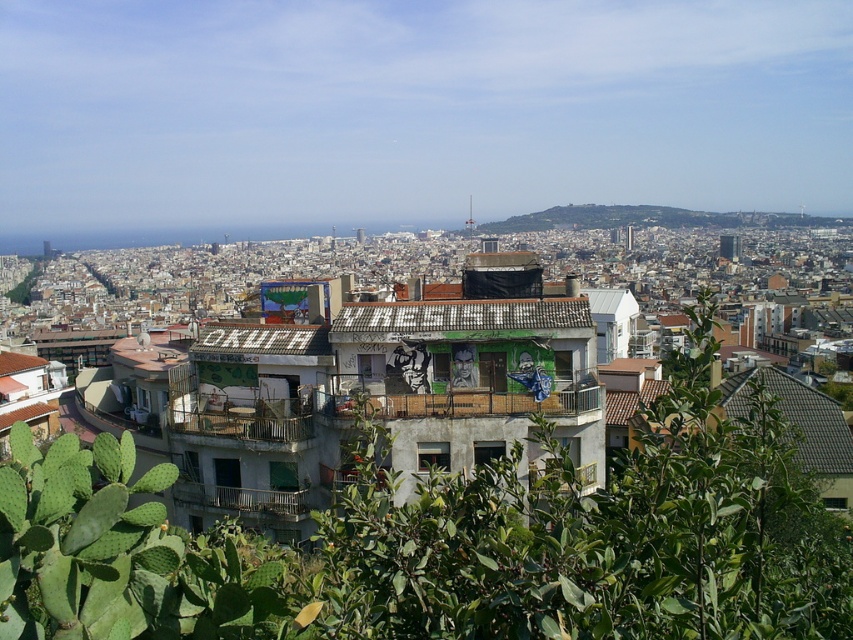
You are standing at the point with coordinates closest to the center of the image. Which of the two points, point (618,468) or point (500,224), is closer to you?

Point (618,468) is closer to you because it is in front of point (500,224).

You are standing in the urban landscape described. There is a point marked at coordinates (457,541). What object is located at that point?

The point at (457,541) indicates a green leafy plant at center.

You are a drone operator trying to capture a photo of the green leafy plant at center and the green grassy hillside at upper center. From your current position, which object is located to the left of the other?

The green leafy plant at center is positioned on the left side of green grassy hillside at upper center, so the green leafy plant at center is to the left of the green grassy hillside at upper center.